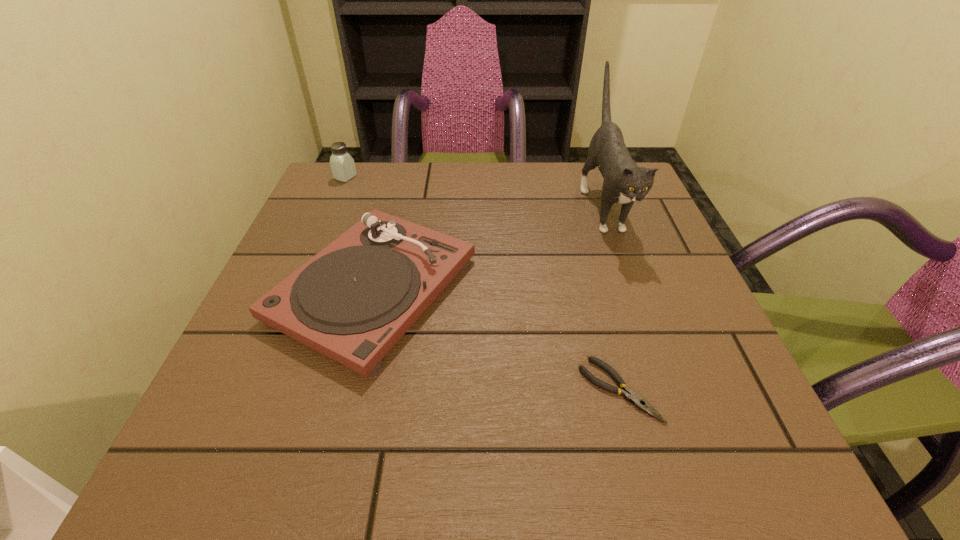
You are a GUI agent. You are given a task and a screenshot of the screen. Output one action in this format:
    pyautogui.click(x=<x>, y=<y>)
    Task: Click on the object situated at the near edge
    The image size is (960, 540).
    Given the screenshot: What is the action you would take?
    pyautogui.click(x=629, y=395)

This screenshot has width=960, height=540. I want to click on saltshaker present at the left edge, so click(342, 164).

The height and width of the screenshot is (540, 960). Identify the location of phonograph_record located in the left edge section of the desktop. (353, 301).

Where is `cat that is positioned at the right edge`? The image size is (960, 540). cat that is positioned at the right edge is located at coordinates (624, 182).

This screenshot has width=960, height=540. Find the location of `pliers at the right edge`. pliers at the right edge is located at coordinates (629, 395).

At what (x,y) coordinates should I click in order to perform the action: click on object at the far left corner. Please return your answer as a coordinate pair (x, y). Looking at the image, I should click on (342, 164).

I want to click on object positioned at the far right corner, so click(x=624, y=182).

This screenshot has height=540, width=960. In order to click on object that is at the near right corner in this screenshot , I will do `click(629, 395)`.

In the image, there is a desktop. Where is `vacant space at the far edge`? The width and height of the screenshot is (960, 540). vacant space at the far edge is located at coordinates (562, 172).

Locate an element on the screen. The height and width of the screenshot is (540, 960). vacant position at the near edge of the desktop is located at coordinates (520, 480).